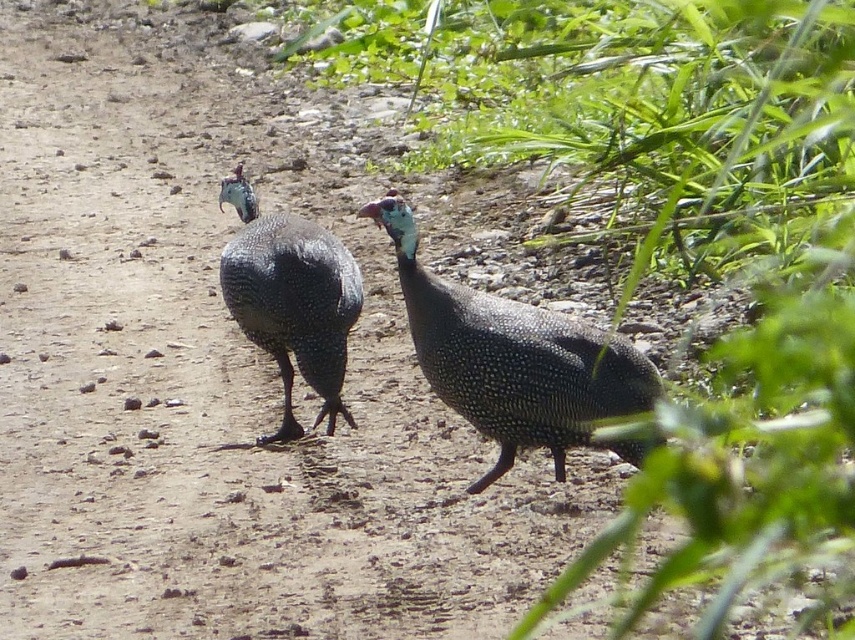
Between point (439, 388) and point (289, 288), which one is positioned behind?

Positioned behind is point (289, 288).

How much distance is there between pearlized glossy guinea fowl at center and satin blue guinea fowl at center?

pearlized glossy guinea fowl at center and satin blue guinea fowl at center are 64.08 centimeters apart from each other.

Which is behind, point (598, 376) or point (342, 246)?

Point (342, 246)

I want to click on pearlized glossy guinea fowl at center, so click(514, 360).

Is green leafy plant at center closer to the viewer compared to satin blue guinea fowl at center?

Yes, green leafy plant at center is closer to the viewer.

Can you confirm if green leafy plant at center is wider than satin blue guinea fowl at center?

Indeed, green leafy plant at center has a greater width compared to satin blue guinea fowl at center.

This screenshot has width=855, height=640. In order to click on green leafy plant at center in this screenshot , I will do `click(749, 444)`.

Identify the location of green leafy plant at center. Image resolution: width=855 pixels, height=640 pixels. (749, 444).

Which is below, green leafy plant at center or pearlized glossy guinea fowl at center?

pearlized glossy guinea fowl at center is lower down.

Between point (809, 141) and point (541, 432), which one is positioned in front?

Point (809, 141) is in front.

What are the coordinates of `green leafy plant at center` in the screenshot? It's located at (749, 444).